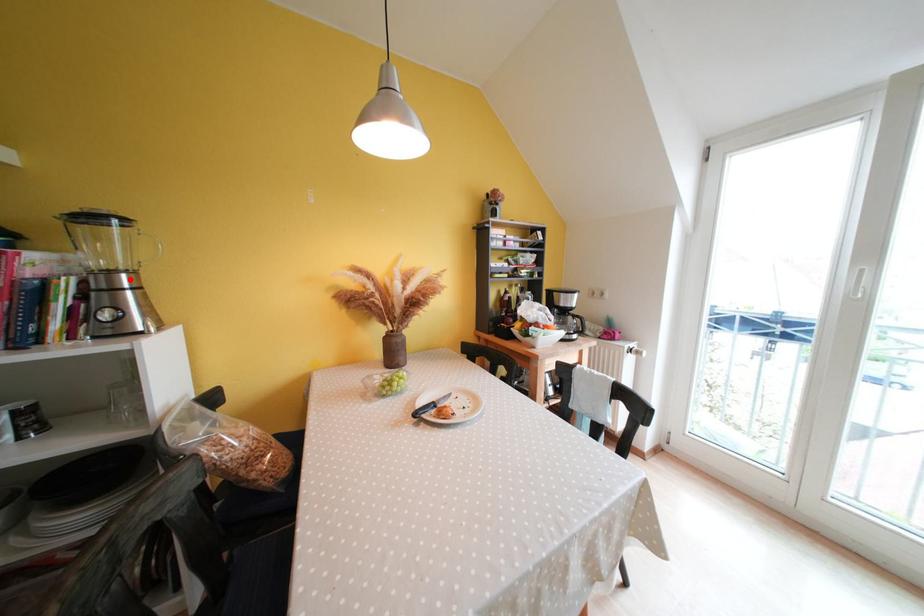
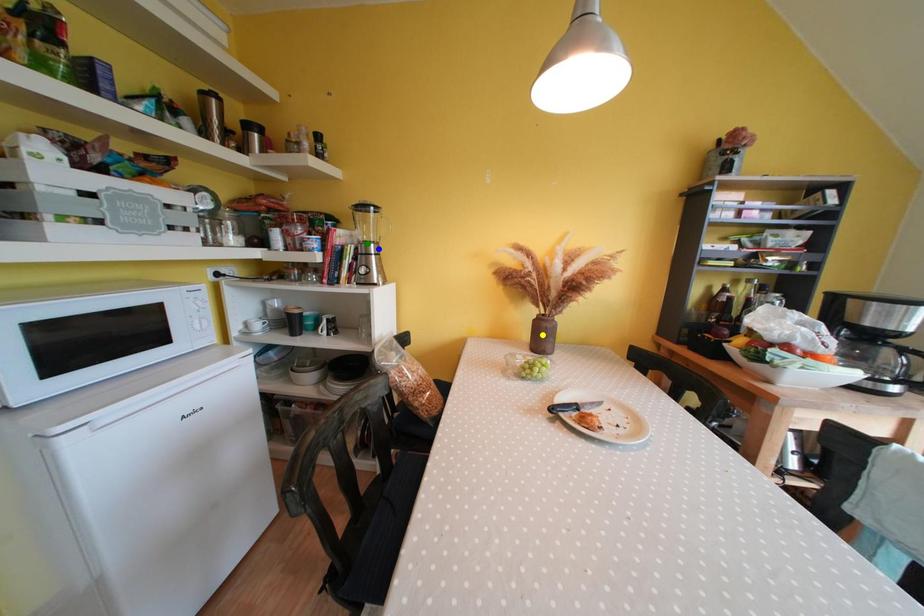
Question: I am providing you with two images of the same scene from different viewpoints. A red point is marked on the first image. You are given multiple points on the second image. Which point in image 2 represents the same 3d spot as the red point in image 1?

Choices:
 (A) green point
 (B) yellow point
 (C) blue point

Answer: (C)